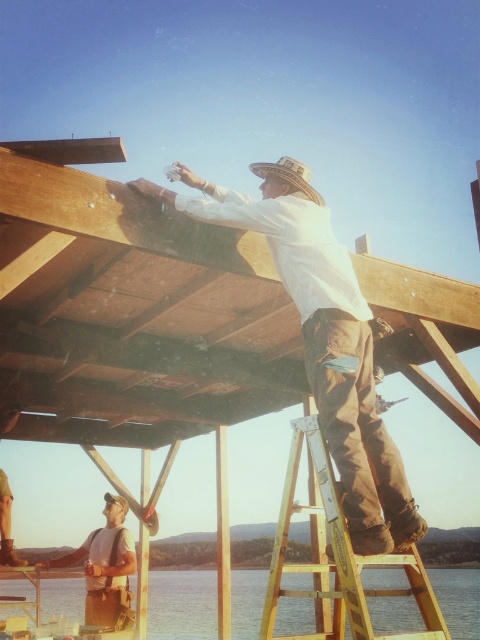
Question: Which of these objects is positioned farthest from the wooden ladder at center?

Choices:
 (A) white cotton shirt at upper center
 (B) tan canvas shirt at lower left

Answer: (B)

Question: Is tan canvas shirt at lower left positioned at the back of rustic straw cowboy hat at upper center?

Choices:
 (A) yes
 (B) no

Answer: (A)

Question: Estimate the real-world distances between objects in this image. Which object is farther from the white cotton shirt at upper center?

Choices:
 (A) transparent water at lower left
 (B) rustic straw cowboy hat at upper center
 (C) tan canvas shirt at lower left

Answer: (A)

Question: Which point is farther from the camera taking this photo?

Choices:
 (A) (384, 616)
 (B) (379, 637)
 (C) (277, 172)
 (D) (118, 577)

Answer: (A)

Question: Is transparent water at lower left positioned in front of wooden ladder at center?

Choices:
 (A) yes
 (B) no

Answer: (B)

Question: Where is white cotton shirt at upper center located in relation to wooden ladder at center in the image?

Choices:
 (A) left
 (B) right

Answer: (A)